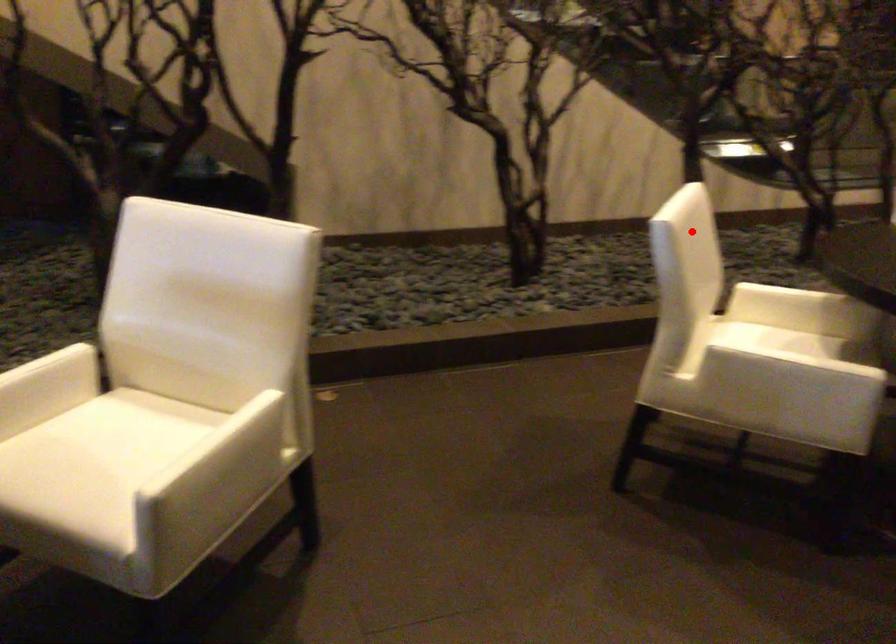
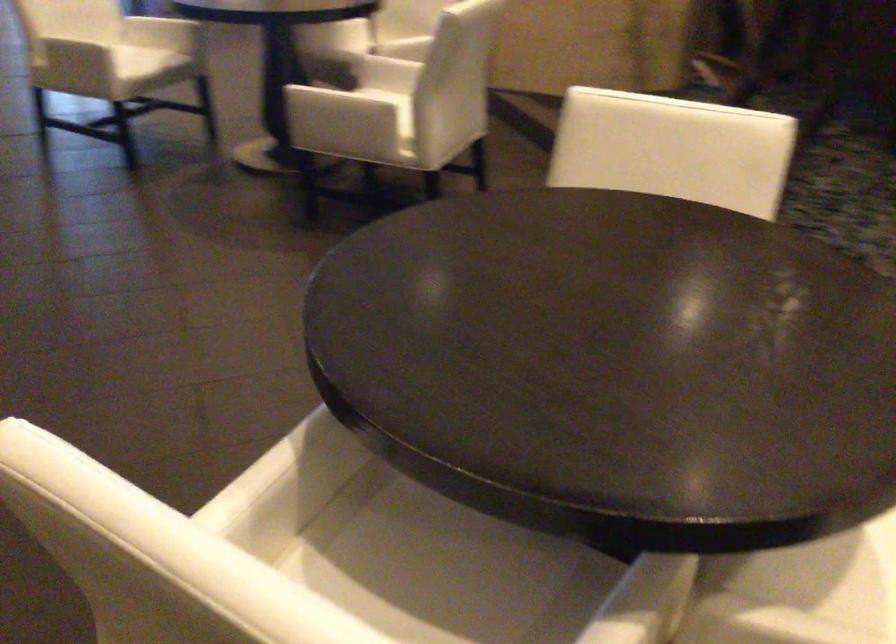
Locate, in the second image, the point that corresponds to the highlighted location in the first image.

(673, 149)